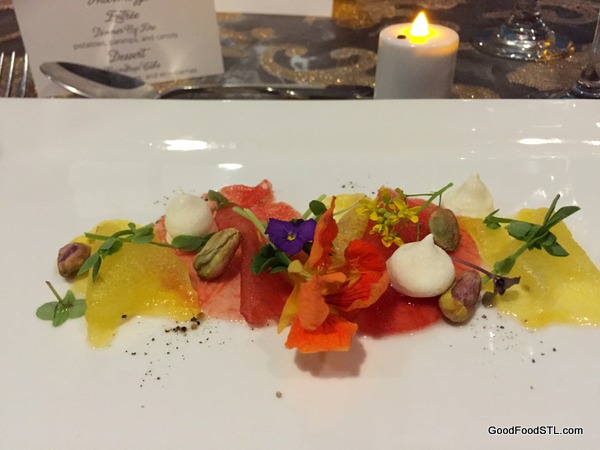
This screenshot has height=450, width=600. I want to click on fake flame, so click(417, 23).